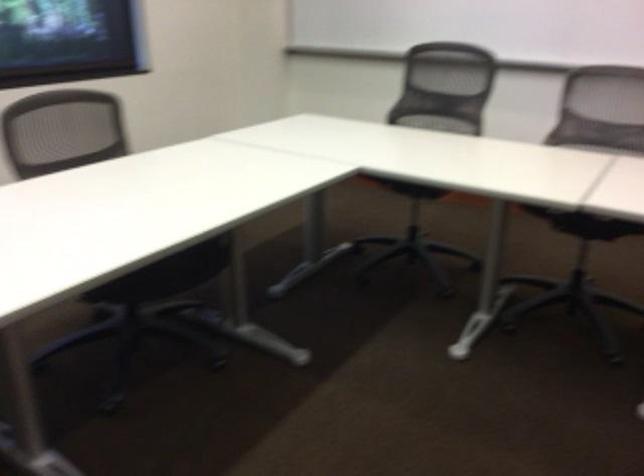
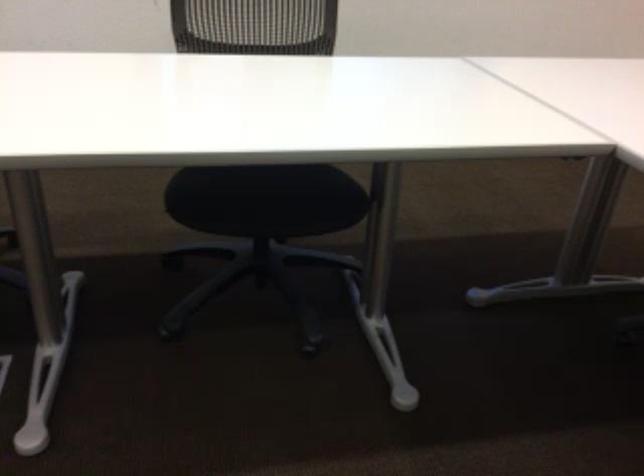
Locate, in the second image, the point that corresponds to pixel 164 266 in the first image.

(266, 199)